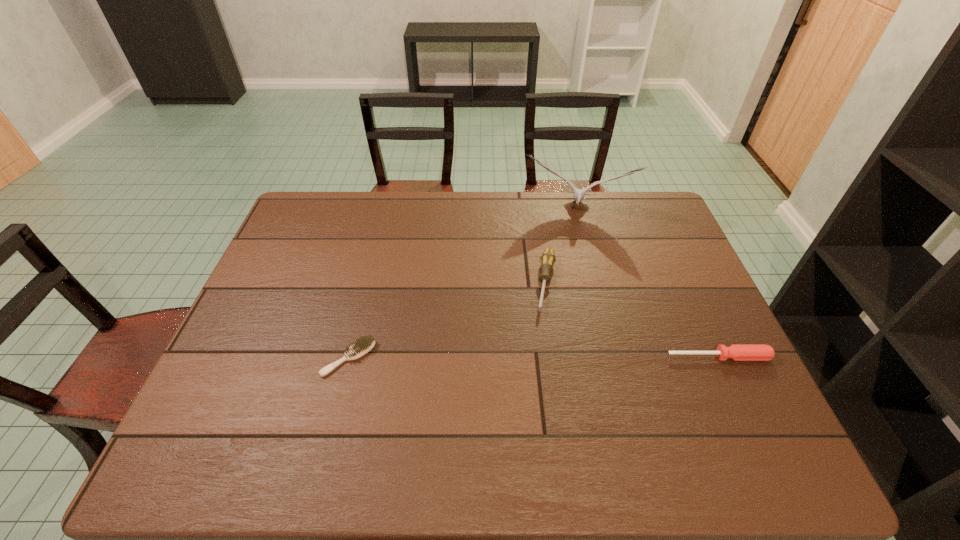
Where is `vacant space on the desktop that is between the shortest object and the right screwdriver and is positioned at the tip of the beak of the tallest object`? The width and height of the screenshot is (960, 540). vacant space on the desktop that is between the shortest object and the right screwdriver and is positioned at the tip of the beak of the tallest object is located at coordinates (560, 357).

Where is `vacant spot on the desktop that is between the scrubbing brush and the right screwdriver and is positioned at the tip of the third shortest object`? This screenshot has height=540, width=960. vacant spot on the desktop that is between the scrubbing brush and the right screwdriver and is positioned at the tip of the third shortest object is located at coordinates (534, 357).